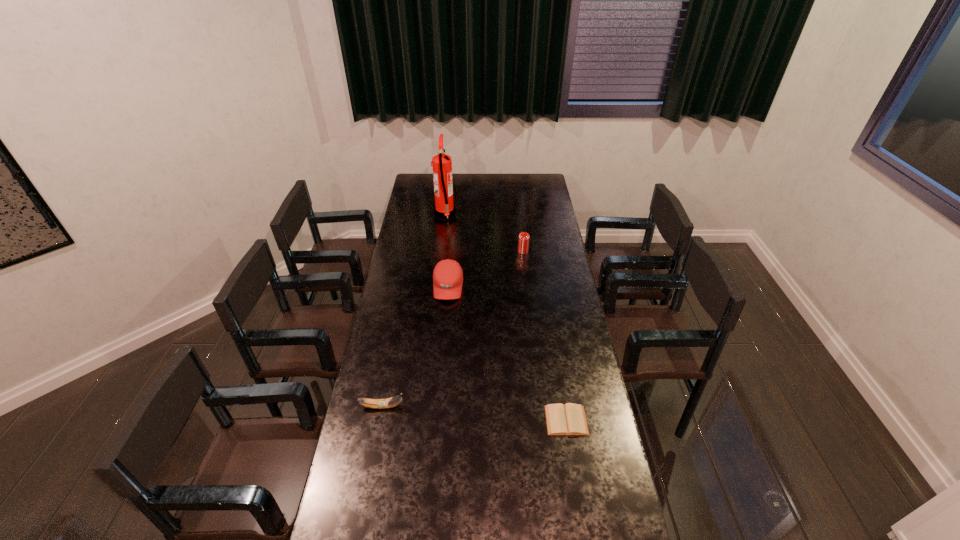
Locate an element on the screen. This screenshot has height=540, width=960. the tallest object is located at coordinates (444, 209).

Find the location of `fire extinguisher`. fire extinguisher is located at coordinates (444, 209).

Locate an element on the screen. This screenshot has width=960, height=540. cap is located at coordinates (447, 276).

This screenshot has width=960, height=540. Find the location of `the fourth nearest object`. the fourth nearest object is located at coordinates (523, 242).

This screenshot has width=960, height=540. Identify the location of the leftmost object. (391, 402).

Locate an element on the screen. The image size is (960, 540). diary is located at coordinates (569, 419).

The height and width of the screenshot is (540, 960). What are the coordinates of `free space located 0.100m with the nozzle aimed from the tallest object` in the screenshot? It's located at (472, 215).

The height and width of the screenshot is (540, 960). Identify the location of vacant position located 0.170m on the front-facing side of the cap. (444, 331).

Identify the location of vacant space positioned 0.220m on the back of the fourth nearest object. This screenshot has height=540, width=960. tap(519, 224).

Identify the location of vacant space located 0.380m on the peel of the banana. (509, 407).